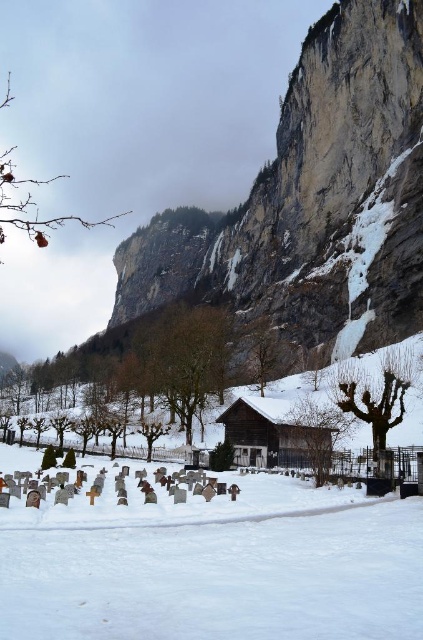
Question: Which of the following is the farthest from the observer?

Choices:
 (A) (269, 605)
 (B) (249, 433)

Answer: (B)

Question: Does white powdery snow at center appear on the left side of wooden cabin at center?

Choices:
 (A) no
 (B) yes

Answer: (B)

Question: Among these objects, which one is farthest from the camera?

Choices:
 (A) white powdery snow at center
 (B) wooden cabin at center

Answer: (B)

Question: Does white powdery snow at center have a smaller size compared to wooden cabin at center?

Choices:
 (A) no
 (B) yes

Answer: (A)

Question: Among these points, which one is nearest to the camera?

Choices:
 (A) (235, 442)
 (B) (54, 611)

Answer: (B)

Question: Is white powdery snow at center above wooden cabin at center?

Choices:
 (A) no
 (B) yes

Answer: (B)